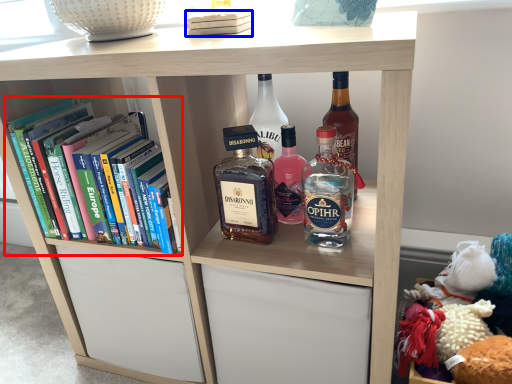
Question: Which object is further to the camera taking this photo, book (highlighted by a red box) or book (highlighted by a blue box)?

Choices:
 (A) book
 (B) book

Answer: (A)